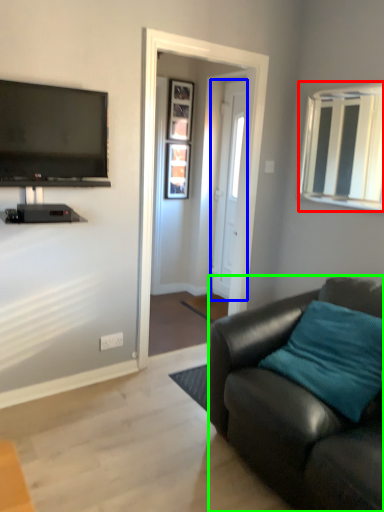
Question: Estimate the real-world distances between objects in this image. Which object is closer to window (highlighted by a red box), door (highlighted by a blue box) or studio couch (highlighted by a green box)?

Choices:
 (A) door
 (B) studio couch

Answer: (A)